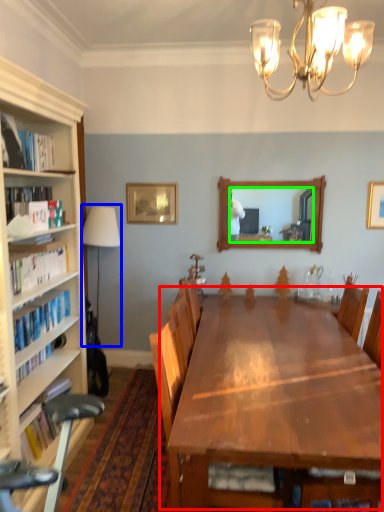
Question: Considering the real-world distances, which object is farthest from table (highlighted by a red box)? lamp (highlighted by a blue box) or mirror (highlighted by a green box)?

Choices:
 (A) lamp
 (B) mirror

Answer: (B)